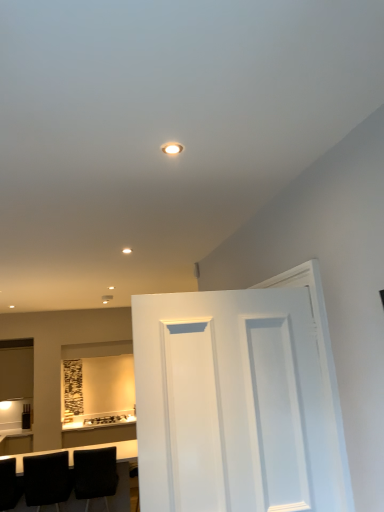
Question: Considering the relative sizes of black matte chair at lower left, the first chair when ordered from right to left, and black leather table at lower left in the image provided, is black matte chair at lower left, the first chair when ordered from right to left, bigger than black leather table at lower left?

Choices:
 (A) no
 (B) yes

Answer: (A)

Question: Does black matte chair at lower left, the 3th chair viewed from the left, lie in front of black leather table at lower left?

Choices:
 (A) yes
 (B) no

Answer: (B)

Question: Is black matte chair at lower left, the 3th chair viewed from the left, looking in the opposite direction of black leather table at lower left?

Choices:
 (A) no
 (B) yes

Answer: (B)

Question: Is the surface of black matte chair at lower left, the 3th chair viewed from the left, in direct contact with black leather table at lower left?

Choices:
 (A) yes
 (B) no

Answer: (B)

Question: Considering the relative sizes of black matte chair at lower left, the first chair when ordered from right to left, and black leather table at lower left in the image provided, is black matte chair at lower left, the first chair when ordered from right to left, shorter than black leather table at lower left?

Choices:
 (A) yes
 (B) no

Answer: (A)

Question: Does black matte chair at lower left, the 3th chair viewed from the left, turn towards black leather table at lower left?

Choices:
 (A) yes
 (B) no

Answer: (A)

Question: From the image's perspective, is white painted wood door at center over black leather chair at lower left, positioned as the second chair in right-to-left order?

Choices:
 (A) yes
 (B) no

Answer: (A)

Question: Is white painted wood door at center closer to camera compared to black leather chair at lower left, the 2th chair positioned from the left?

Choices:
 (A) yes
 (B) no

Answer: (A)

Question: Is white painted wood door at center looking in the opposite direction of black leather chair at lower left, positioned as the second chair in right-to-left order?

Choices:
 (A) no
 (B) yes

Answer: (A)

Question: Would you consider white painted wood door at center to be distant from black leather chair at lower left, the 2th chair positioned from the left?

Choices:
 (A) yes
 (B) no

Answer: (A)

Question: Considering the relative sizes of white painted wood door at center and black leather chair at lower left, the 2th chair positioned from the left, in the image provided, is white painted wood door at center smaller than black leather chair at lower left, the 2th chair positioned from the left,?

Choices:
 (A) yes
 (B) no

Answer: (B)

Question: Does white painted wood door at center have a greater width compared to black leather chair at lower left, the 2th chair positioned from the left?

Choices:
 (A) yes
 (B) no

Answer: (B)

Question: Is black leather chair at lower left, the 2th chair positioned from the left, surrounding black leather table at lower left?

Choices:
 (A) no
 (B) yes

Answer: (A)